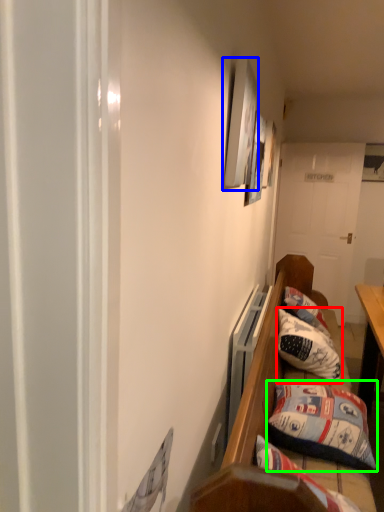
Question: Considering the real-world distances, which object is closest to pillow (highlighted by a red box)? picture frame (highlighted by a blue box) or pillow (highlighted by a green box).

Choices:
 (A) picture frame
 (B) pillow

Answer: (B)